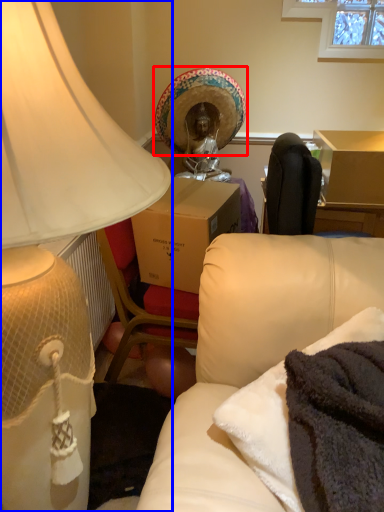
Question: Which object appears closest to the camera in this image, headdress (highlighted by a red box) or lamp (highlighted by a blue box)?

Choices:
 (A) headdress
 (B) lamp

Answer: (B)